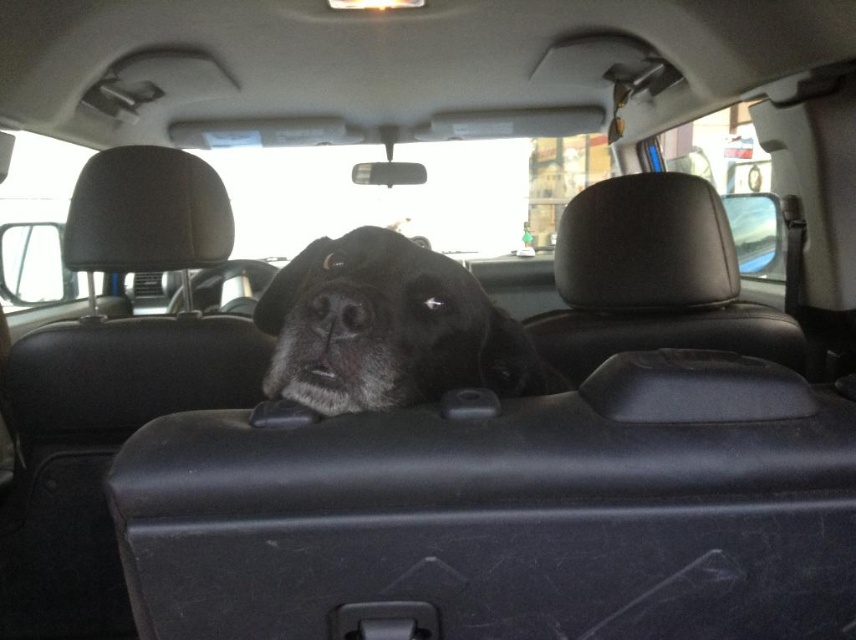
Question: Which point appears farthest from the camera in this image?

Choices:
 (A) (484, 323)
 (B) (310, 300)

Answer: (A)

Question: Is black fur dog at center smaller than black matte nose at center?

Choices:
 (A) no
 (B) yes

Answer: (A)

Question: Can you confirm if black fur dog at center is thinner than black matte nose at center?

Choices:
 (A) no
 (B) yes

Answer: (A)

Question: Which point is farther to the camera?

Choices:
 (A) black fur dog at center
 (B) black matte nose at center

Answer: (B)

Question: Is black fur dog at center to the right of black matte nose at center from the viewer's perspective?

Choices:
 (A) yes
 (B) no

Answer: (A)